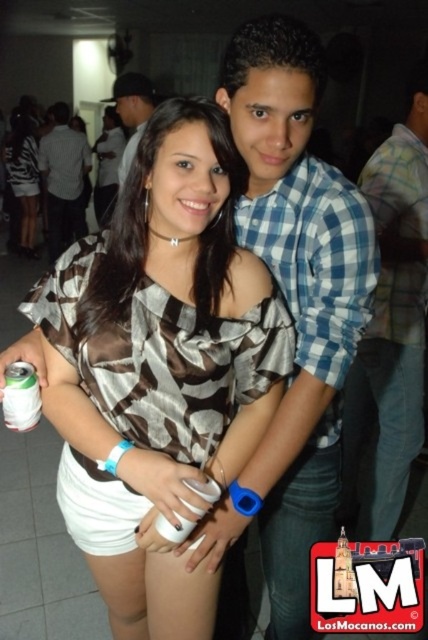
Looking at this image, is matte black dress at center smaller than green matte can at lower left?

No, matte black dress at center is not smaller than green matte can at lower left.

Which is more to the left, matte black dress at center or green matte can at lower left?

Positioned to the left is matte black dress at center.

The image size is (428, 640). I want to click on matte black dress at center, so coord(23,180).

Can you confirm if blue checkered shirt at center is shorter than blue plaid shirt at center?

Correct, blue checkered shirt at center is not as tall as blue plaid shirt at center.

Find the location of a particular element. This screenshot has width=428, height=640. blue checkered shirt at center is located at coordinates (297, 291).

What do you see at coordinates (297, 291) in the screenshot? I see `blue checkered shirt at center` at bounding box center [297, 291].

This screenshot has height=640, width=428. I want to click on blue checkered shirt at center, so click(297, 291).

Which is below, blue plaid shirt at center or matte black shirt at center?

blue plaid shirt at center is lower down.

Is blue plaid shirt at center to the left of matte black shirt at center from the viewer's perspective?

Incorrect, blue plaid shirt at center is not on the left side of matte black shirt at center.

Between point (357, 364) and point (53, 218), which one is positioned behind?

Point (53, 218)

Find the location of a particular element. The image size is (428, 640). blue plaid shirt at center is located at coordinates (392, 324).